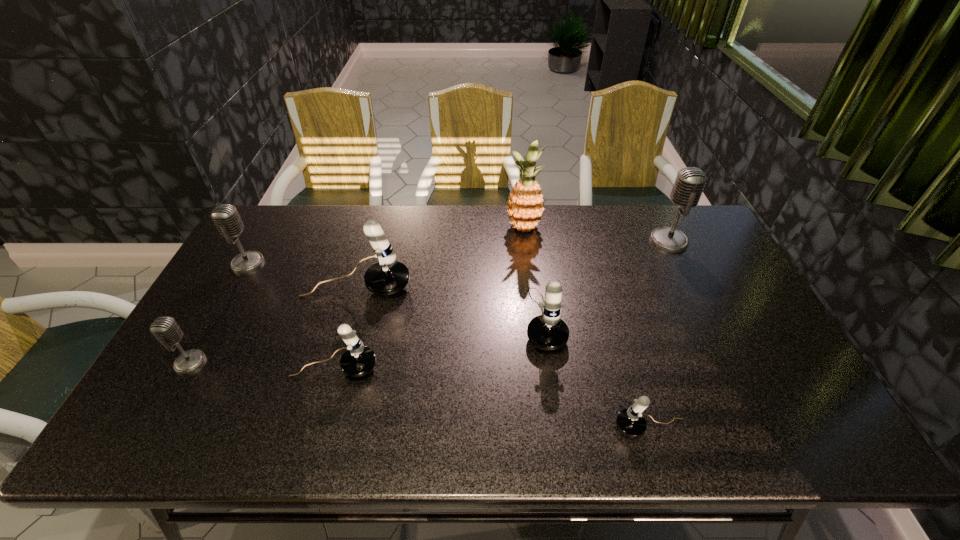
Locate which gray microphone ranks third in proximity to the rightmost white microphone. Please provide its 2D coordinates. Your answer should be formatted as a tuple, i.e. [(x, y)], where the tuple contains the x and y coordinates of a point satisfying the conditions above.

[(225, 216)]

Where is `gray microphone that is the closest one to the nearest gray microphone`? This screenshot has height=540, width=960. gray microphone that is the closest one to the nearest gray microphone is located at coordinates (225, 216).

Identify the location of white microphone object that ranks as the third closest to the rightmost white microphone. Image resolution: width=960 pixels, height=540 pixels. (386, 277).

Select which white microphone is the closest to the tallest object. Please provide its 2D coordinates. Your answer should be formatted as a tuple, i.e. [(x, y)], where the tuple contains the x and y coordinates of a point satisfying the conditions above.

[(547, 331)]

Locate an element on the screen. free space that satisfies the following two spatial constraints: 1. on the back side of the second nearest gray microphone; 2. on the left side of the tallest object is located at coordinates (267, 228).

Image resolution: width=960 pixels, height=540 pixels. I want to click on free location that satisfies the following two spatial constraints: 1. on the back side of the third biggest white microphone; 2. on the right side of the third microphone from right to left, so click(x=349, y=318).

At what (x,y) coordinates should I click in order to perform the action: click on free location that satisfies the following two spatial constraints: 1. on the back side of the second smallest white microphone; 2. on the left side of the fifth microphone from left to right. Please return your answer as a coordinate pair (x, y). Looking at the image, I should click on (349, 318).